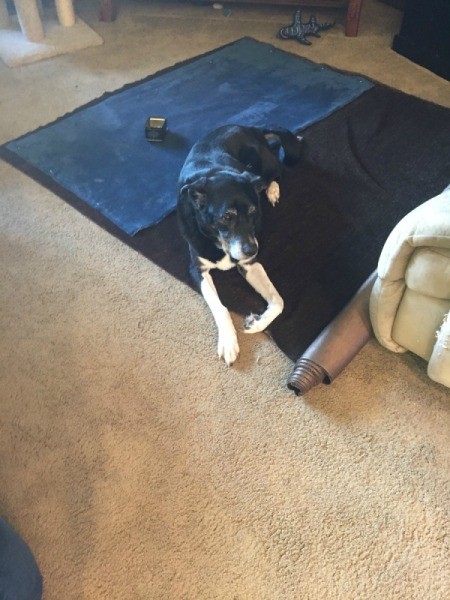
This screenshot has height=600, width=450. What are the coordinates of `empty space on carpet` in the screenshot? It's located at (108, 335), (301, 497), (171, 39).